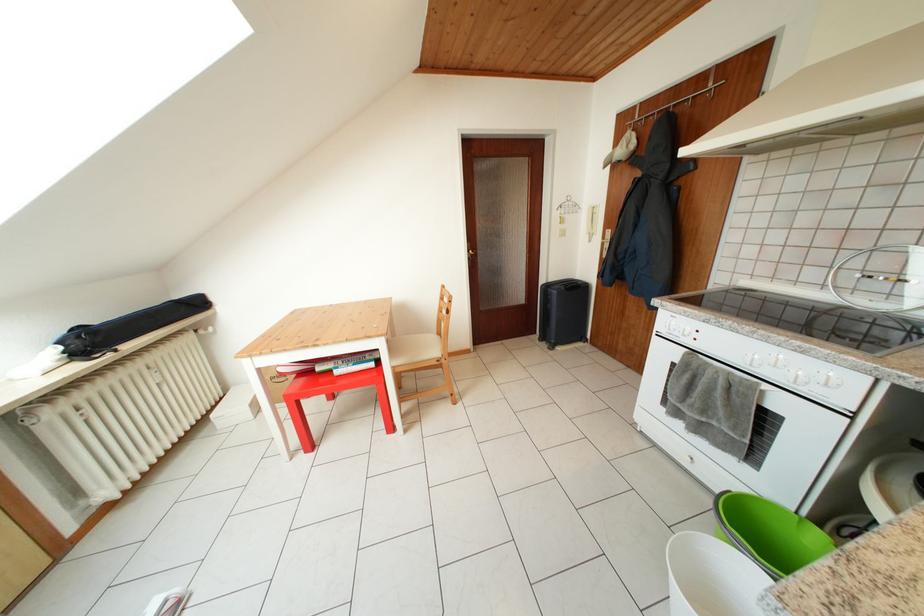
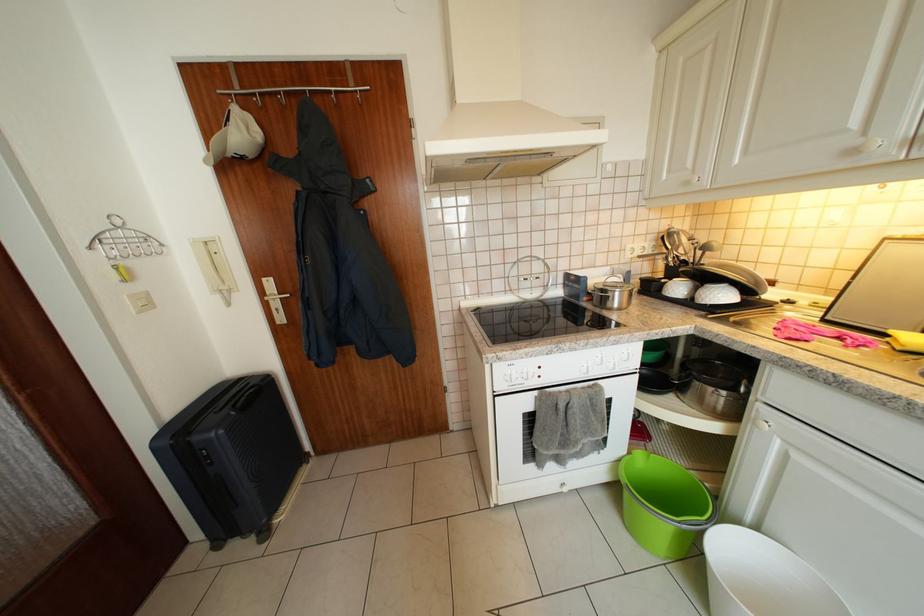
The point at (612,243) is marked in the first image. Where is the corresponding point in the second image?

(271, 299)